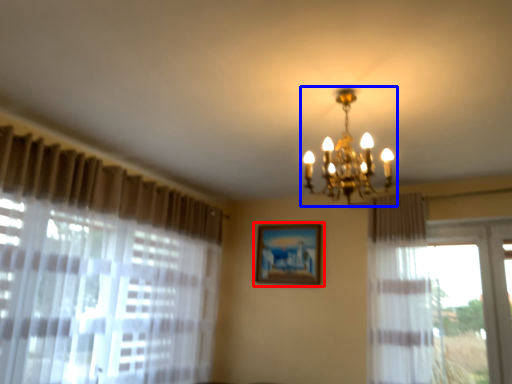
Question: Which object appears closest to the camera in this image, picture frame (highlighted by a red box) or lamp (highlighted by a blue box)?

Choices:
 (A) picture frame
 (B) lamp

Answer: (B)